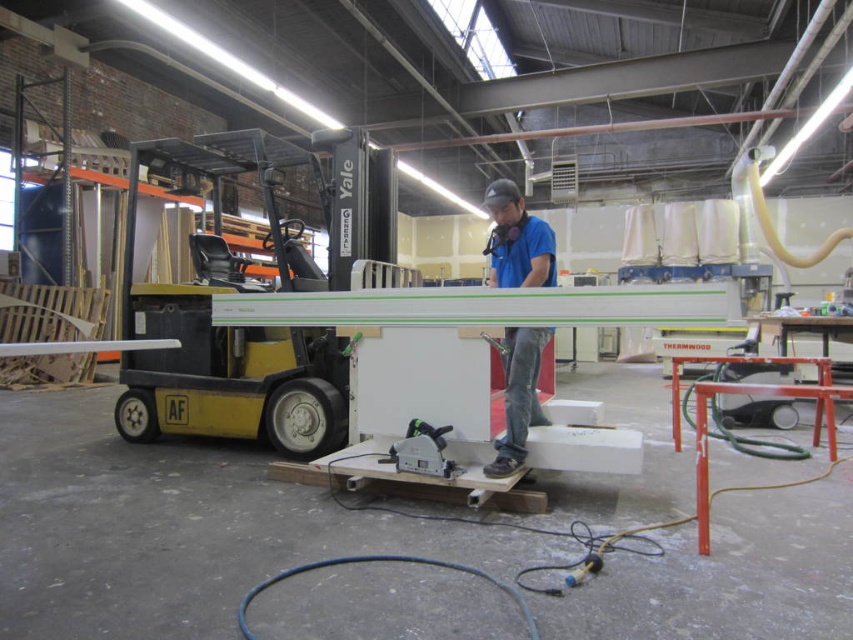
Is yellow/black plastic forklift at left shorter than blue cotton shirt at center?

In fact, yellow/black plastic forklift at left may be taller than blue cotton shirt at center.

Is yellow/black plastic forklift at left closer to camera compared to blue cotton shirt at center?

No, yellow/black plastic forklift at left is behind blue cotton shirt at center.

Locate an element on the screen. yellow/black plastic forklift at left is located at coordinates pyautogui.click(x=234, y=324).

Locate an element on the screen. This screenshot has width=853, height=640. blue cotton shirt at center is located at coordinates (517, 241).

Where is `blue cotton shirt at center`? The image size is (853, 640). blue cotton shirt at center is located at coordinates (517, 241).

Does yellow/black plastic forklift at left have a larger size compared to green plastic circular saw at center?

Yes.

The height and width of the screenshot is (640, 853). What do you see at coordinates (234, 324) in the screenshot?
I see `yellow/black plastic forklift at left` at bounding box center [234, 324].

Does point (196, 300) lie in front of point (440, 428)?

No, (196, 300) is further to viewer.

The height and width of the screenshot is (640, 853). Identify the location of yellow/black plastic forklift at left. (234, 324).